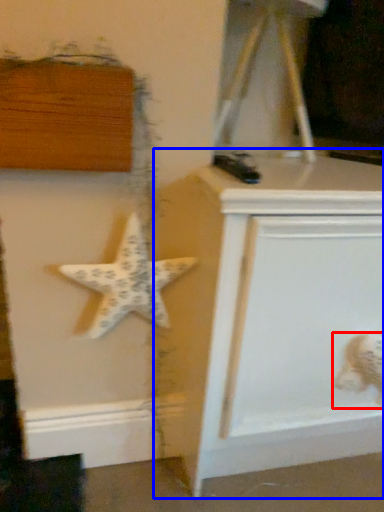
Question: Which object is closer to the camera taking this photo, toy (highlighted by a red box) or vanity (highlighted by a blue box)?

Choices:
 (A) toy
 (B) vanity

Answer: (B)